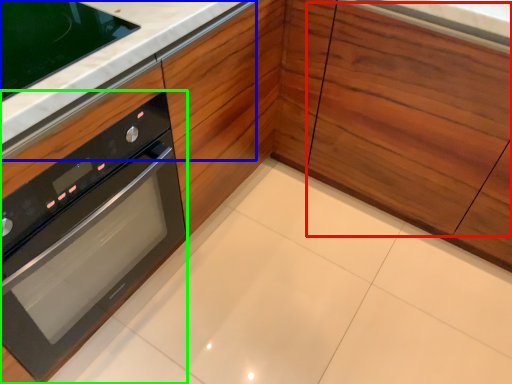
Question: Based on their relative distances, which object is nearer to drawer (highlighted by a red box)? Choose from counter top (highlighted by a blue box) and oven (highlighted by a green box).

Choices:
 (A) counter top
 (B) oven

Answer: (A)